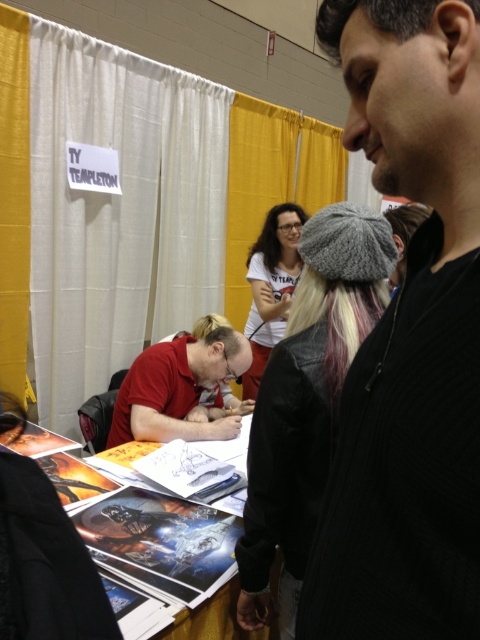
Is black knit cap at upper right behind white matte t-shirt at center?

No, black knit cap at upper right is in front of white matte t-shirt at center.

Which is in front, point (472, 273) or point (260, 333)?

Point (472, 273)

You are a GUI agent. You are given a task and a screenshot of the screen. Output one action in this format:
    pyautogui.click(x=<x>, y=<y>)
    Task: Click on the black knit cap at upper right
    The width and height of the screenshot is (480, 640).
    Given the screenshot: What is the action you would take?
    click(408, 340)

Does gray knit hat at upper center have a larger size compared to white matte t-shirt at center?

No.

From the picture: Does gray knit hat at upper center have a lesser width compared to white matte t-shirt at center?

Indeed, gray knit hat at upper center has a lesser width compared to white matte t-shirt at center.

This screenshot has height=640, width=480. In order to click on gray knit hat at upper center in this screenshot , I will do `click(307, 401)`.

Locate an element on the screen. gray knit hat at upper center is located at coordinates (307, 401).

Does gray knit hat at upper center have a lesser width compared to red matte shirt at center?

Correct, gray knit hat at upper center's width is less than red matte shirt at center's.

Based on the photo, does gray knit hat at upper center have a greater width compared to red matte shirt at center?

No, gray knit hat at upper center is not wider than red matte shirt at center.

Is point (369, 285) closer to viewer compared to point (131, 422)?

Yes, point (369, 285) is in front of point (131, 422).

In order to click on gray knit hat at upper center in this screenshot , I will do `click(307, 401)`.